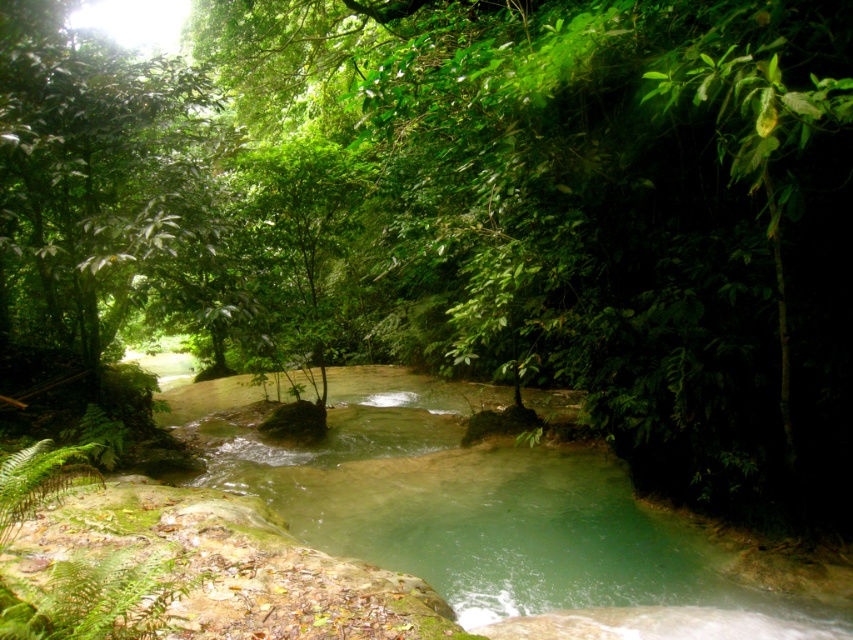
You are a hiker who wants to cross the stream safely. The clear water at center is part of the stream. The green leafy tree at upper left is on the bank. How far apart are these two landmarks?

The clear water at center is 11.69 feet away from the green leafy tree at upper left, so the distance between them is 11.69 feet.

You are a hiker navigating through this forest. You need to cross the stream but want to avoid the deeper parts. Based on the scene, which direction should you head relative to the green leafy tree at upper left to find the shallower, clear water at center?

The clear water at center is positioned on the right side of the green leafy tree at upper left, so you should head towards the right side of the green leafy tree at upper left to find the shallower, clear water at center.

Looking at this image, you are navigating a small boat through the stream in the image. If you want to reach the clear water at center, which direction should you steer your boat relative to your current position at point 0.802, 0.567?

The clear water at center is located at point [483,513], so you are already at the desired location.